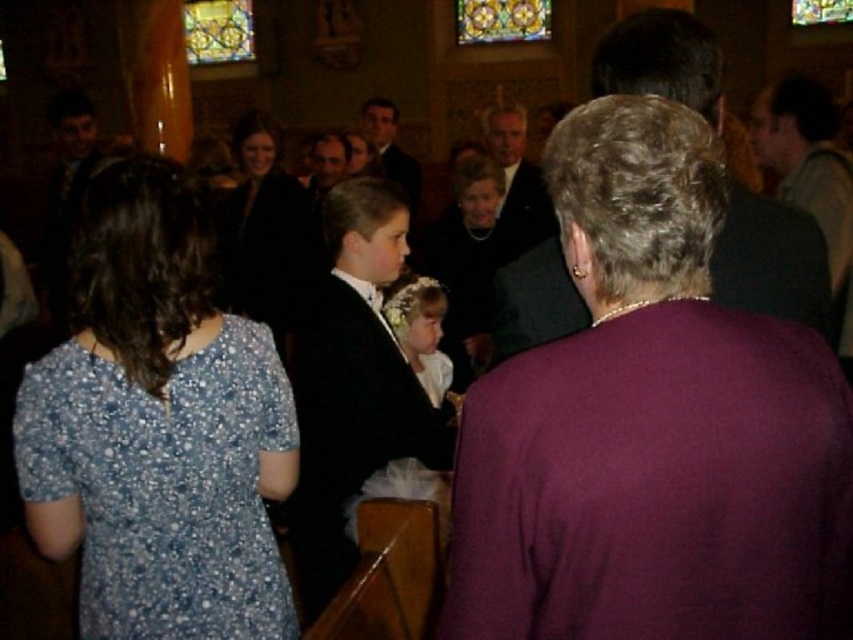
Is the position of black satin dress at center more distant than that of gray wool sweater at upper right?

Yes, black satin dress at center is further from the viewer.

Which of these two, black satin dress at center or gray wool sweater at upper right, stands taller?

With more height is gray wool sweater at upper right.

Locate an element on the screen. Image resolution: width=853 pixels, height=640 pixels. black satin dress at center is located at coordinates (265, 230).

Which of these two, black satin suit at center or gray wool sweater at upper right, stands shorter?

gray wool sweater at upper right is shorter.

In the scene shown: Is black satin suit at center taller than gray wool sweater at upper right?

Yes.

Who is more forward, [347,385] or [799,136]?

Point [347,385] is in front.

Where is `black satin suit at center`? This screenshot has height=640, width=853. black satin suit at center is located at coordinates (352, 381).

Which is behind, point (337, 198) or point (335, 161)?

The point (335, 161) is more distant.

Does black satin suit at center have a greater width compared to matte black suit at center?

Correct, the width of black satin suit at center exceeds that of matte black suit at center.

Where is `black satin suit at center`? black satin suit at center is located at coordinates (352, 381).